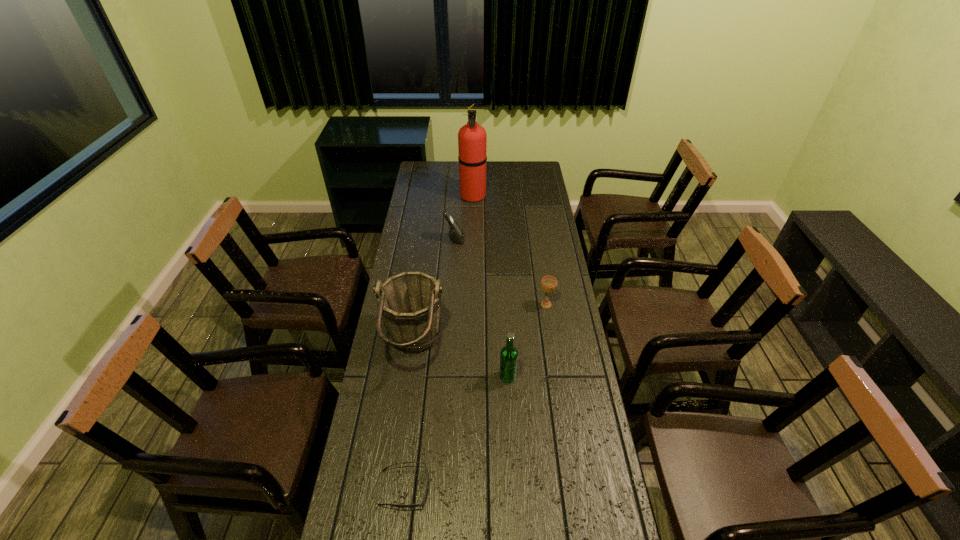
Find the location of `vacant space at the far edge of the desktop`. vacant space at the far edge of the desktop is located at coordinates (505, 182).

In the image, there is a desktop. Find the location of `blank space at the left edge`. blank space at the left edge is located at coordinates pyautogui.click(x=418, y=186).

Find the location of a particular element. Image resolution: width=960 pixels, height=540 pixels. free spot at the right edge of the desktop is located at coordinates (571, 369).

Locate an element on the screen. Image resolution: width=960 pixels, height=540 pixels. free space at the far right corner of the desktop is located at coordinates (545, 176).

The width and height of the screenshot is (960, 540). In order to click on free point between the chalice and the fifth object from left to right in this screenshot , I will do `click(527, 341)`.

The height and width of the screenshot is (540, 960). What are the coordinates of `free spot between the farthest object and the second farthest object` in the screenshot? It's located at (464, 218).

Find the location of `free space between the beer bottle and the second farthest object`. free space between the beer bottle and the second farthest object is located at coordinates (481, 308).

At what (x,y) coordinates should I click in order to perform the action: click on free space between the sunglasses and the fire extinguisher. Please return your answer as a coordinate pair (x, y). The width and height of the screenshot is (960, 540). Looking at the image, I should click on (439, 342).

Find the location of a particular element. The height and width of the screenshot is (540, 960). empty space between the tallest object and the bucket is located at coordinates (444, 271).

Identify the location of free area in between the farthest object and the sunglasses. (439, 342).